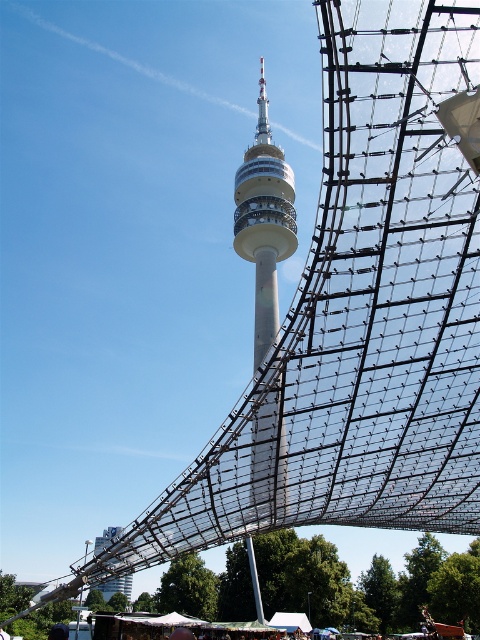
Based on the photo, is metallic mesh structure at lower center to the left of smooth concrete tower at center from the viewer's perspective?

Correct, you'll find metallic mesh structure at lower center to the left of smooth concrete tower at center.

Is metallic mesh structure at lower center taller than smooth concrete tower at center?

Incorrect, metallic mesh structure at lower center's height is not larger of smooth concrete tower at center's.

Which is behind, point (423, 595) or point (266, 312)?

The point (423, 595) is behind.

I want to click on metallic mesh structure at lower center, so click(368, 582).